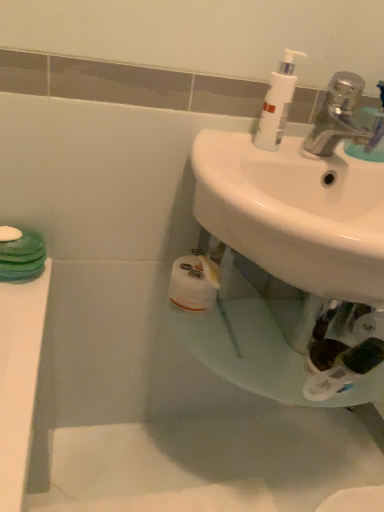
Image resolution: width=384 pixels, height=512 pixels. What do you see at coordinates (277, 103) in the screenshot? I see `white plastic pump bottle at upper right` at bounding box center [277, 103].

The image size is (384, 512). In order to click on silver metallic faucet at upper right in this screenshot , I will do pos(342,118).

I want to click on white plastic pump bottle at upper right, so click(x=277, y=103).

From a real-world perspective, is white glossy sink at center positioned above or below silver metallic faucet at upper right?

Clearly, from a real-world perspective, white glossy sink at center is below silver metallic faucet at upper right.

Considering the positions of objects white glossy sink at center and silver metallic faucet at upper right in the image provided, who is in front, white glossy sink at center or silver metallic faucet at upper right?

white glossy sink at center is in front.

Based on the photo, is silver metallic faucet at upper right at the back of white glossy sink at center?

No, white glossy sink at center is not facing the opposite direction of silver metallic faucet at upper right.

Between white plastic pump bottle at upper right and silver metallic faucet at upper right, which one appears on the left side from the viewer's perspective?

white plastic pump bottle at upper right is more to the left.

Is white plastic pump bottle at upper right placed right next to silver metallic faucet at upper right?

They are not placed beside each other.

From the image's perspective, is white glossy sink at center under white plastic pump bottle at upper right?

Correct, white glossy sink at center appears lower than white plastic pump bottle at upper right in the image.

Is white glossy sink at center to the left or to the right of white plastic pump bottle at upper right in the image?

From the image, it's evident that white glossy sink at center is to the right of white plastic pump bottle at upper right.

Choose the correct answer: Is white glossy sink at center inside white plastic pump bottle at upper right or outside it?

The correct answer is: outside.

Between white glossy sink at center and white plastic pump bottle at upper right, which one has smaller size?

white plastic pump bottle at upper right.

Considering the points (376, 144) and (280, 142), which point is in front, point (376, 144) or point (280, 142)?

The point (376, 144) is closer.

Choose the correct answer: Is silver metallic faucet at upper right inside white plastic pump bottle at upper right or outside it?

silver metallic faucet at upper right is located beyond the bounds of white plastic pump bottle at upper right.

Between silver metallic faucet at upper right and white plastic pump bottle at upper right, which one has larger width?

silver metallic faucet at upper right.

Who is more distant, silver metallic faucet at upper right or white plastic pump bottle at upper right?

white plastic pump bottle at upper right is further from the camera.

Which is in front, point (282, 101) or point (341, 175)?

The point (282, 101) is more forward.

Looking at their sizes, would you say white plastic pump bottle at upper right is wider or thinner than white glossy sink at center?

Considering their sizes, white plastic pump bottle at upper right looks slimmer than white glossy sink at center.

Could you tell me if white plastic pump bottle at upper right is turned towards white glossy sink at center?

No, white plastic pump bottle at upper right is not turned towards white glossy sink at center.

How many degrees apart are the facing directions of white plastic pump bottle at upper right and white glossy sink at center?

The facing directions of white plastic pump bottle at upper right and white glossy sink at center are 0.000178 degrees apart.

Is silver metallic faucet at upper right not near white glossy sink at center?

silver metallic faucet at upper right is near white glossy sink at center, not far away.

From a real-world perspective, is silver metallic faucet at upper right below white glossy sink at center?

Incorrect, from a real-world perspective, silver metallic faucet at upper right is higher than white glossy sink at center.

Considering the relative positions of silver metallic faucet at upper right and white glossy sink at center in the image provided, is silver metallic faucet at upper right to the left or to the right of white glossy sink at center?

silver metallic faucet at upper right is to the right of white glossy sink at center.

Consider the image. Does silver metallic faucet at upper right lie in front of white glossy sink at center?

No, the depth of silver metallic faucet at upper right is greater than that of white glossy sink at center.

This screenshot has width=384, height=512. In order to click on tap behind the white glossy sink at center in this screenshot , I will do `click(342, 118)`.

In the image, there is a white plastic pump bottle at upper right. Identify the location of tap below it (from the image's perspective). (342, 118).

When comparing their distances from white glossy sink at center, does white plastic pump bottle at upper right or silver metallic faucet at upper right seem closer?

silver metallic faucet at upper right.

Based on their spatial positions, is silver metallic faucet at upper right or white plastic pump bottle at upper right further from white glossy sink at center?

The object further to white glossy sink at center is white plastic pump bottle at upper right.

From the image, which object appears to be farther from white plastic pump bottle at upper right, silver metallic faucet at upper right or white glossy sink at center?

Among the two, white glossy sink at center is located further to white plastic pump bottle at upper right.

Which object lies nearer to the anchor point silver metallic faucet at upper right, white glossy sink at center or white plastic pump bottle at upper right?

Based on the image, white plastic pump bottle at upper right appears to be nearer to silver metallic faucet at upper right.

Considering their positions, is white glossy sink at center positioned closer to white plastic pump bottle at upper right than silver metallic faucet at upper right?

silver metallic faucet at upper right.

Estimate the real-world distances between objects in this image. Which object is closer to silver metallic faucet at upper right, white plastic pump bottle at upper right or white glossy sink at center?

Among the two, white plastic pump bottle at upper right is located nearer to silver metallic faucet at upper right.

Where is `tap between white glossy sink at center and white plastic pump bottle at upper right from front to back`? The width and height of the screenshot is (384, 512). tap between white glossy sink at center and white plastic pump bottle at upper right from front to back is located at coordinates (342, 118).